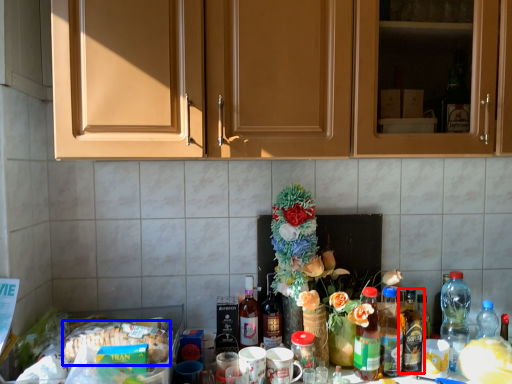
Question: Among these objects, which one is nearest to the camera, bottle (highlighted by a red box) or food (highlighted by a blue box)?

Choices:
 (A) bottle
 (B) food

Answer: (B)